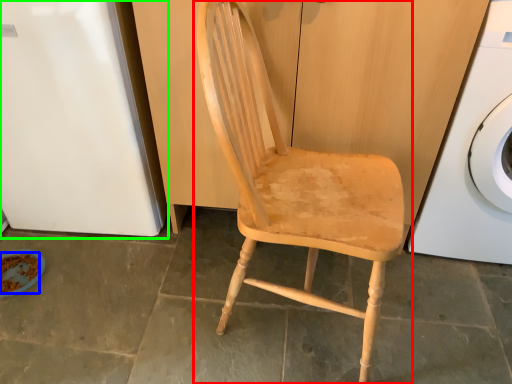
Question: Estimate the real-world distances between objects in this image. Which object is farther from chair (highlighted by a red box), food (highlighted by a blue box) or leftover (highlighted by a green box)?

Choices:
 (A) food
 (B) leftover

Answer: (A)